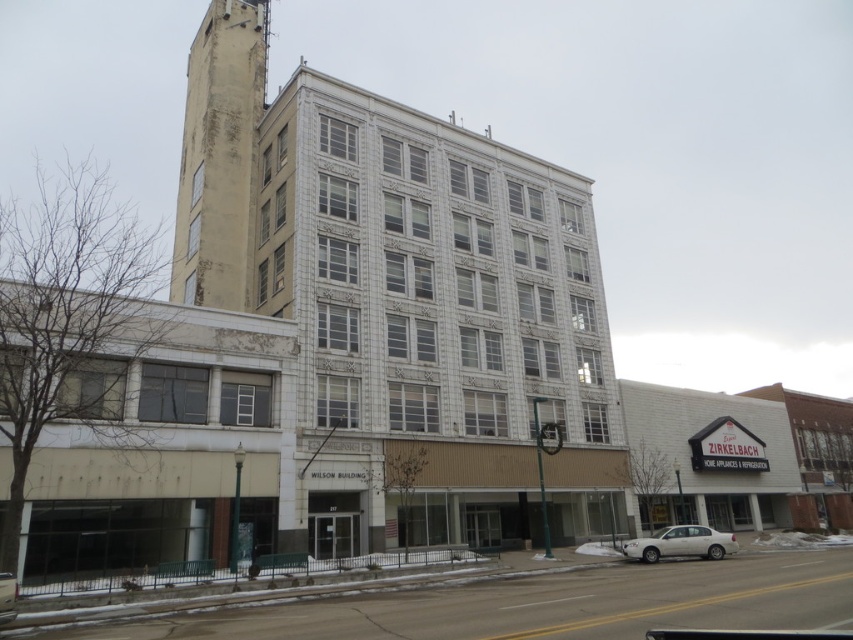
You are a delivery driver who needs to park your truck in the parking lot behind the building. The parking space you want is between the white matte sedan at lower center and the silver metallic sedan at lower left. The truck requires a 100 feet space to maneuver. Can you fit your truck in that space?

The distance between the white matte sedan at lower center and the silver metallic sedan at lower left is 84.25 feet. Since the truck requires 100 feet to maneuver, the space is too narrow. You cannot fit your truck between them.

You are a delivery person trying to park your silver metallic sedan at lower left near the yellowish concrete bell tower at upper left. Considering the height difference between them, do you think the sedan will block the view of the bell tower from the street?

The yellowish concrete bell tower at upper left is taller than the silver metallic sedan at lower left, so parking the sedan near it will not block the view of the bell tower from the street since the tower is higher.

You are a delivery driver who needs to park your silver metallic sedan at lower left as close as possible to the yellowish concrete bell tower at upper left. Given that the parking area is on the ground floor, can you park your car directly underneath the bell tower?

The yellowish concrete bell tower at upper left is above the silver metallic sedan at lower left, so yes, you can park the silver metallic sedan at lower left directly underneath the bell tower since it is positioned below it.